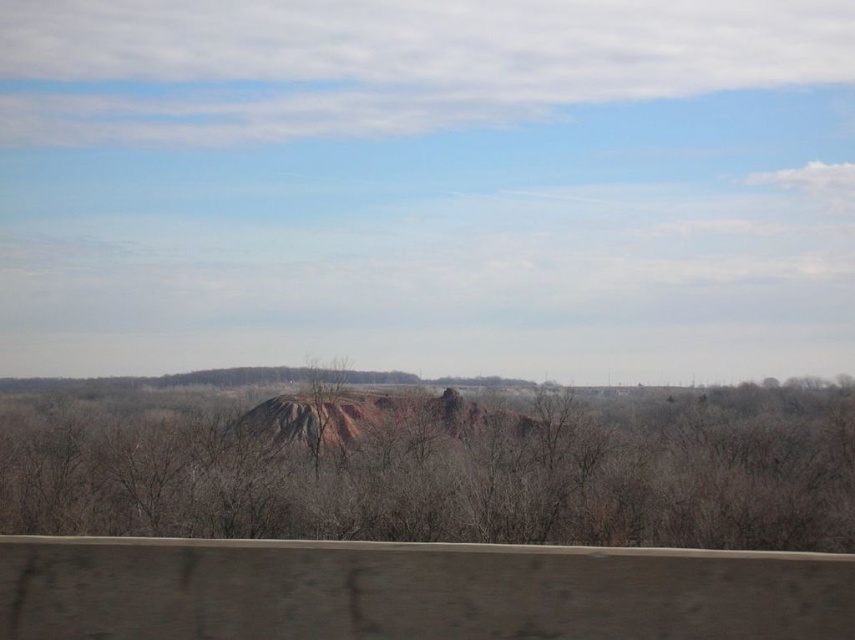
Question: Which point appears closest to the camera in this image?

Choices:
 (A) (411, 429)
 (B) (119, 449)

Answer: (B)

Question: Does brown matte tree at center have a smaller size compared to rustic clay mountain at center?

Choices:
 (A) yes
 (B) no

Answer: (B)

Question: Is brown matte tree at center smaller than rustic clay mountain at center?

Choices:
 (A) no
 (B) yes

Answer: (A)

Question: Does brown matte tree at center appear under rustic clay mountain at center?

Choices:
 (A) no
 (B) yes

Answer: (B)